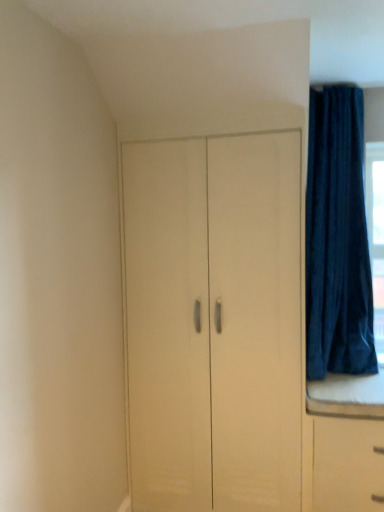
Where is `dark blue velvet curtain at upper right`? The height and width of the screenshot is (512, 384). dark blue velvet curtain at upper right is located at coordinates (337, 238).

This screenshot has width=384, height=512. What do you see at coordinates (337, 238) in the screenshot?
I see `dark blue velvet curtain at upper right` at bounding box center [337, 238].

At what (x,y) coordinates should I click in order to perform the action: click on matte white cupboard at center. Please return your answer as a coordinate pair (x, y). Looking at the image, I should click on (214, 322).

What do you see at coordinates (214, 322) in the screenshot? I see `matte white cupboard at center` at bounding box center [214, 322].

At what (x,y) coordinates should I click in order to perform the action: click on dark blue velvet curtain at upper right. Please return your answer as a coordinate pair (x, y). Looking at the image, I should click on (337, 238).

Is matte white cupboard at center at the left side of dark blue velvet curtain at upper right?

Yes, matte white cupboard at center is to the left of dark blue velvet curtain at upper right.

Which object is further away from the camera taking this photo, matte white cupboard at center or dark blue velvet curtain at upper right?

dark blue velvet curtain at upper right.

Which is farther from the camera, (185, 482) or (332, 300)?

The point (332, 300) is farther from the camera.

From the image's perspective, between matte white cupboard at center and dark blue velvet curtain at upper right, who is located below?

matte white cupboard at center is shown below in the image.

From a real-world perspective, which is physically above, matte white cupboard at center or dark blue velvet curtain at upper right?

From a 3D spatial view, dark blue velvet curtain at upper right is above.

Considering the relative sizes of matte white cupboard at center and dark blue velvet curtain at upper right in the image provided, is matte white cupboard at center wider than dark blue velvet curtain at upper right?

No, matte white cupboard at center is not wider than dark blue velvet curtain at upper right.

Considering the relative sizes of matte white cupboard at center and dark blue velvet curtain at upper right in the image provided, is matte white cupboard at center shorter than dark blue velvet curtain at upper right?

No.

Can you confirm if matte white cupboard at center is bigger than dark blue velvet curtain at upper right?

Correct, matte white cupboard at center is larger in size than dark blue velvet curtain at upper right.

Is matte white cupboard at center inside or outside of dark blue velvet curtain at upper right?

matte white cupboard at center is spatially situated outside dark blue velvet curtain at upper right.

Are matte white cupboard at center and dark blue velvet curtain at upper right located far from each other?

No, matte white cupboard at center is not far from dark blue velvet curtain at upper right.

Is matte white cupboard at center positioned with its back to dark blue velvet curtain at upper right?

No, matte white cupboard at center is not facing the opposite direction of dark blue velvet curtain at upper right.

How many degrees apart are the facing directions of matte white cupboard at center and dark blue velvet curtain at upper right?

0.214 degrees separate the facing orientations of matte white cupboard at center and dark blue velvet curtain at upper right.

How distant is matte white cupboard at center from dark blue velvet curtain at upper right?

They are 24.26 inches apart.

Find the location of a particular element. The width and height of the screenshot is (384, 512). cupboard on the left of dark blue velvet curtain at upper right is located at coordinates (214, 322).

Can you confirm if dark blue velvet curtain at upper right is positioned to the left of matte white cupboard at center?

No, dark blue velvet curtain at upper right is not to the left of matte white cupboard at center.

Considering their positions, is dark blue velvet curtain at upper right located in front of or behind matte white cupboard at center?

Clearly, dark blue velvet curtain at upper right is behind matte white cupboard at center.

Which is less distant, (357, 329) or (152, 391)?

Clearly, point (357, 329) is more distant from the camera than point (152, 391).

From the image's perspective, between dark blue velvet curtain at upper right and matte white cupboard at center, which one is located above?

dark blue velvet curtain at upper right is shown above in the image.

From a real-world perspective, which object stands above the other?

Answer: In real-world perspective, dark blue velvet curtain at upper right is above.

Does dark blue velvet curtain at upper right have a greater width compared to matte white cupboard at center?

Indeed, dark blue velvet curtain at upper right has a greater width compared to matte white cupboard at center.

Considering the sizes of dark blue velvet curtain at upper right and matte white cupboard at center in the image, is dark blue velvet curtain at upper right taller or shorter than matte white cupboard at center?

Clearly, dark blue velvet curtain at upper right is shorter compared to matte white cupboard at center.

Can you confirm if dark blue velvet curtain at upper right is smaller than matte white cupboard at center?

Yes, dark blue velvet curtain at upper right is smaller than matte white cupboard at center.

Is matte white cupboard at center inside dark blue velvet curtain at upper right?

No, matte white cupboard at center is not a part of dark blue velvet curtain at upper right.

Does dark blue velvet curtain at upper right touch matte white cupboard at center?

dark blue velvet curtain at upper right is not next to matte white cupboard at center, and they're not touching.

Could you tell me if dark blue velvet curtain at upper right is facing matte white cupboard at center?

No, dark blue velvet curtain at upper right is not oriented towards matte white cupboard at center.

This screenshot has width=384, height=512. In the image, there is a dark blue velvet curtain at upper right. Find the location of `cupboard below it (from a real-world perspective)`. cupboard below it (from a real-world perspective) is located at coordinates (214, 322).

In order to click on curtain that is on the right side of matte white cupboard at center in this screenshot , I will do pos(337,238).

What are the coordinates of `cupboard below the dark blue velvet curtain at upper right (from a real-world perspective)` in the screenshot? It's located at (214, 322).